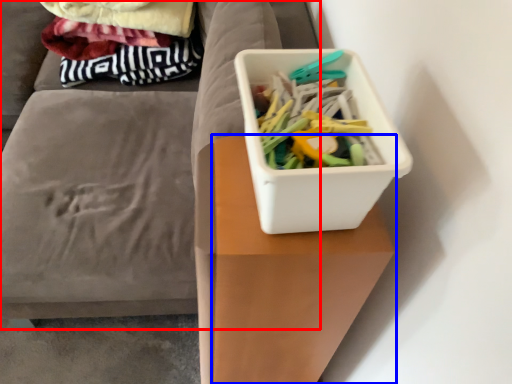
Question: Which object appears farthest to the camera in this image, furniture (highlighted by a red box) or table (highlighted by a blue box)?

Choices:
 (A) furniture
 (B) table

Answer: (A)